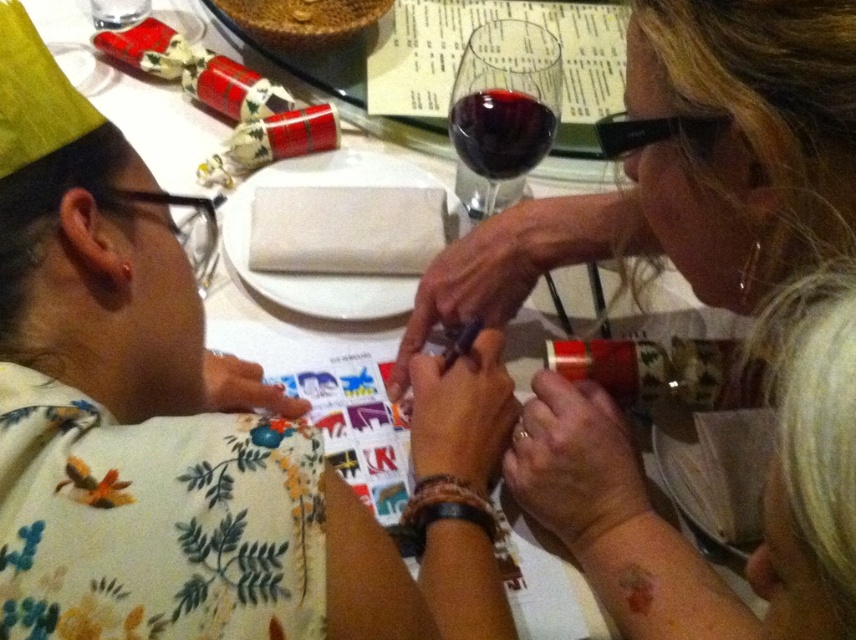
Question: Among these points, which one is farthest from the camera?

Choices:
 (A) (730, 99)
 (B) (714, 116)

Answer: (B)

Question: Based on their relative distances, which object is farther from the dark red glass at upper center?

Choices:
 (A) black plastic glasses at upper right
 (B) floral fabric shirt at center

Answer: (B)

Question: Which is farther from the black plastic goggles at left?

Choices:
 (A) dark red glass at upper center
 (B) black plastic glasses at upper right
 (C) floral fabric shirt at center
 (D) transparent glass at center

Answer: (B)

Question: Observing the image, what is the correct spatial positioning of floral fabric shirt at center in reference to black plastic goggles at left?

Choices:
 (A) left
 (B) right

Answer: (B)

Question: Does floral fabric shirt at center have a larger size compared to dark red glass at upper center?

Choices:
 (A) no
 (B) yes

Answer: (B)

Question: Where is floral fabric shirt at center located in relation to black plastic goggles at left in the image?

Choices:
 (A) right
 (B) left

Answer: (A)